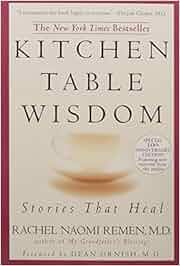
The image size is (180, 266). What are the coordinates of `tea cup handle` in the screenshot? It's located at (52, 143).